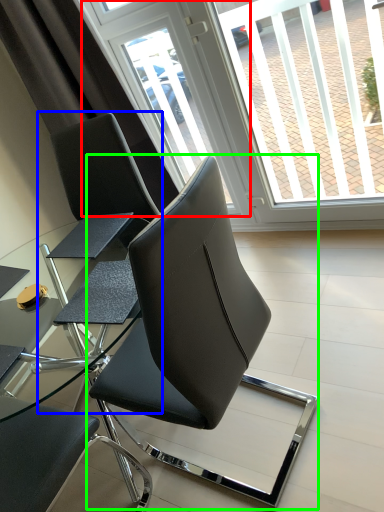
Question: Which is farther away from screen door (highlighted by a red box)? chair (highlighted by a blue box) or chair (highlighted by a green box)?

Choices:
 (A) chair
 (B) chair

Answer: (B)